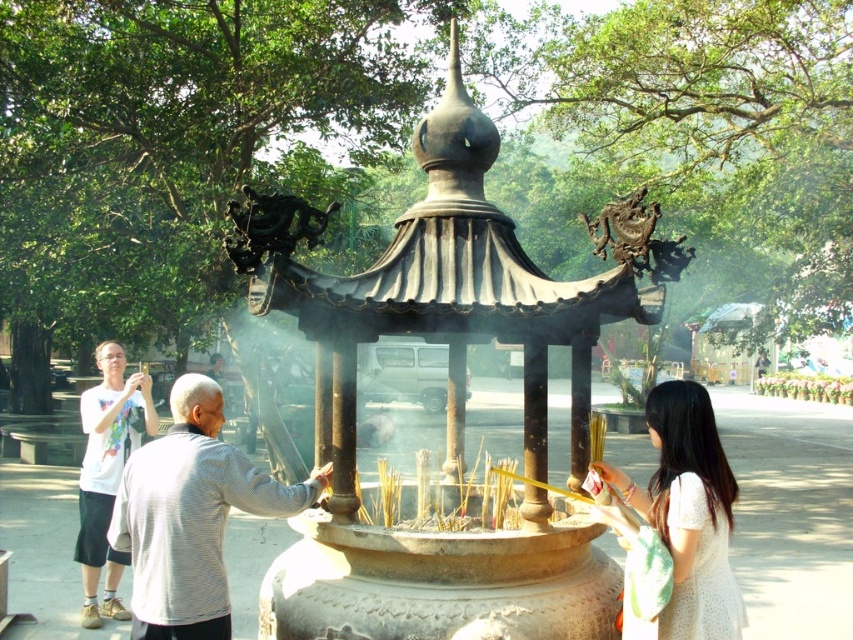
Question: Which object is positioned farthest from the bronze/golden incense burner at center?

Choices:
 (A) white cotton shirt at left
 (B) gray striped shirt at center
 (C) white lace dress at lower right

Answer: (A)

Question: Which object is positioned farthest from the bronze/golden incense burner at center?

Choices:
 (A) white cotton shirt at left
 (B) gray striped shirt at center
 (C) white lace dress at lower right

Answer: (A)

Question: Is gray striped shirt at center below white cotton shirt at left?

Choices:
 (A) no
 (B) yes

Answer: (A)

Question: Is bronze/golden incense burner at center further to the viewer compared to gray striped shirt at center?

Choices:
 (A) yes
 (B) no

Answer: (A)

Question: Does white lace dress at lower right appear on the right side of white cotton shirt at left?

Choices:
 (A) no
 (B) yes

Answer: (B)

Question: Which point is closer to the camera?

Choices:
 (A) bronze/golden incense burner at center
 (B) gray striped shirt at center
 (C) white cotton shirt at left

Answer: (B)